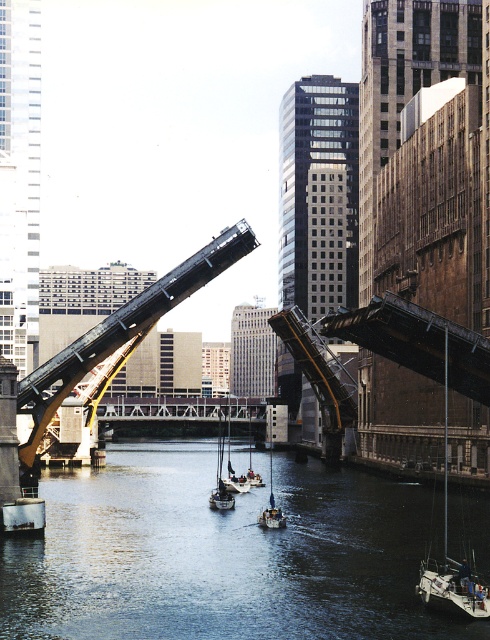
Does metallic gray boat at center have a smaller size compared to white wooden sailboat at center?

Indeed, metallic gray boat at center has a smaller size compared to white wooden sailboat at center.

The image size is (490, 640). What are the coordinates of `metallic gray boat at center` in the screenshot? It's located at (271, 464).

Is point (270, 524) less distant than point (226, 490)?

That is True.

This screenshot has height=640, width=490. Find the location of `metallic gray boat at center`. metallic gray boat at center is located at coordinates (271, 464).

Can you confirm if dark blue water at center is thinner than white wooden sailboat at center?

No.

Is dark blue water at center taller than white wooden sailboat at center?

No.

What are the coordinates of `dark blue water at center` in the screenshot? It's located at (222, 554).

Locate an element on the screen. dark blue water at center is located at coordinates (222, 554).

Is dark blue water at center smaller than white matte sailboat at lower right?

No.

Consider the image. Can you confirm if dark blue water at center is positioned below white matte sailboat at lower right?

Yes.

The width and height of the screenshot is (490, 640). Describe the element at coordinates (222, 554) in the screenshot. I see `dark blue water at center` at that location.

Identify the location of dark blue water at center. (222, 554).